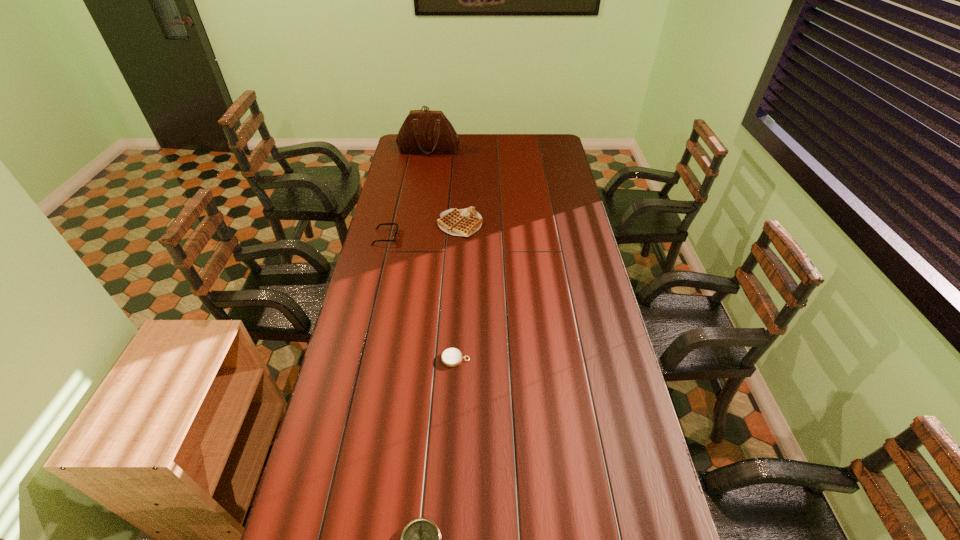
At what (x,y) coordinates should I click in order to perform the action: click on the farthest object. Please return your answer as a coordinate pair (x, y). The height and width of the screenshot is (540, 960). Looking at the image, I should click on (423, 131).

The width and height of the screenshot is (960, 540). I want to click on the tallest object, so click(423, 131).

The height and width of the screenshot is (540, 960). Find the location of `the fourth shortest object`. the fourth shortest object is located at coordinates (464, 222).

Where is `sunglasses`? This screenshot has width=960, height=540. sunglasses is located at coordinates (396, 224).

Find the location of a particular element. The width and height of the screenshot is (960, 540). the shortest object is located at coordinates (451, 357).

The image size is (960, 540). Identify the location of the shorter compass. (451, 357).

In order to click on free space located on the front of the tallest object in this screenshot , I will do `click(421, 191)`.

In order to click on vacant space located on the right of the fourth shortest object in this screenshot , I will do `click(515, 224)`.

Identify the location of vacant space situated 0.220m on the front-facing side of the third shortest object. The width and height of the screenshot is (960, 540). (449, 237).

Find the location of a particular element. The height and width of the screenshot is (540, 960). vacant region located on the front of the shorter compass is located at coordinates (453, 407).